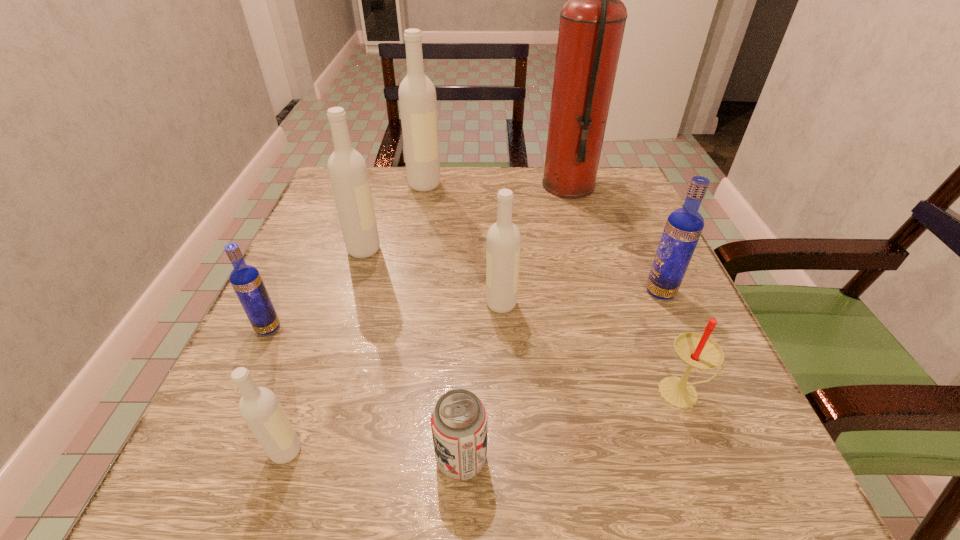
This screenshot has width=960, height=540. In order to click on vacant region located on the right of the farthest white vodka in this screenshot , I will do `click(586, 184)`.

Find the location of a particular element. The image size is (960, 540). blank space located 0.060m on the front of the second farthest vodka is located at coordinates (355, 280).

The height and width of the screenshot is (540, 960). What are the coordinates of `free point located on the left of the bigger blue vodka` in the screenshot? It's located at coord(577,292).

Find the location of a particular element. vacant area situated on the right of the sixth object from left to right is located at coordinates (619, 304).

At what (x,y) coordinates should I click in order to perform the action: click on vacant space located on the right of the nearer blue vodka. Please return your answer as a coordinate pair (x, y). Looking at the image, I should click on (446, 328).

The image size is (960, 540). In order to click on vacant space located on the right of the nearest vodka in this screenshot , I will do `click(505, 451)`.

Where is `free spot located on the back of the candle`? Image resolution: width=960 pixels, height=540 pixels. free spot located on the back of the candle is located at coordinates (660, 332).

Where is `vacant space situated 0.320m on the back of the beer can`? The width and height of the screenshot is (960, 540). vacant space situated 0.320m on the back of the beer can is located at coordinates (468, 282).

In order to click on fire extinguisher at the far edge in this screenshot , I will do `click(592, 22)`.

Identify the location of vodka at the far edge. (417, 96).